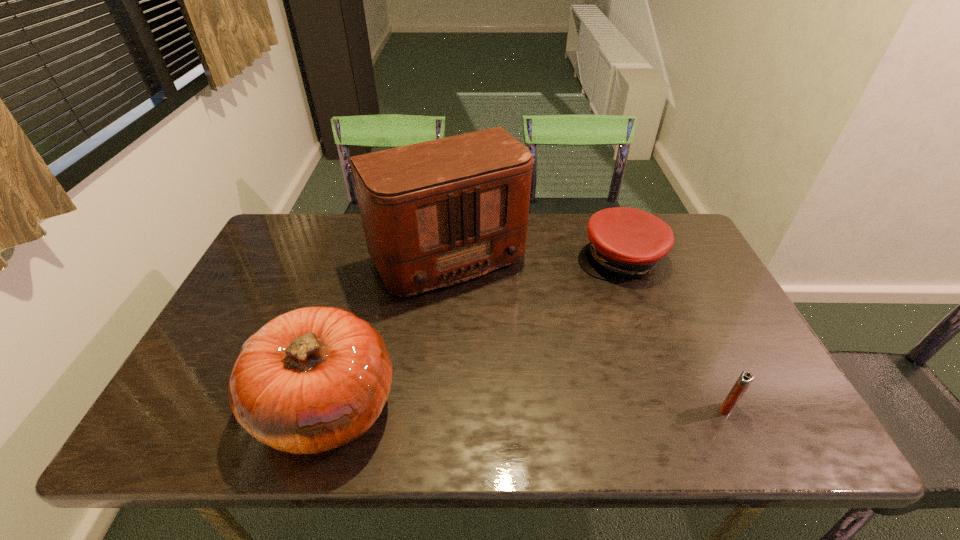
Where is `free spot on the desktop that is between the pumpkin and the igniter and is positioned on the front panel of the radio receiver`? free spot on the desktop that is between the pumpkin and the igniter and is positioned on the front panel of the radio receiver is located at coordinates 539,407.

The image size is (960, 540). Identify the location of free space on the desktop that is between the pumpkin and the igniter and is positioned at the front of the cap where the visor is located. (583, 407).